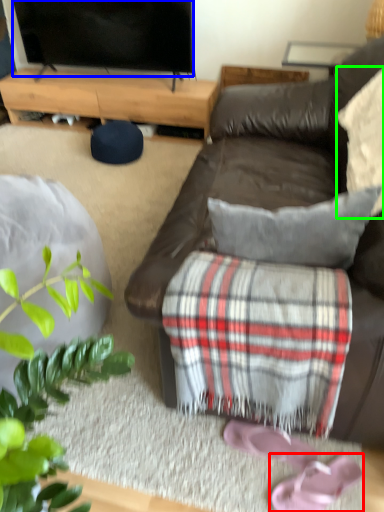
Question: Which is nearer to the footwear (highlighted by a red box)? television (highlighted by a blue box) or pillow (highlighted by a green box).

Choices:
 (A) television
 (B) pillow

Answer: (B)